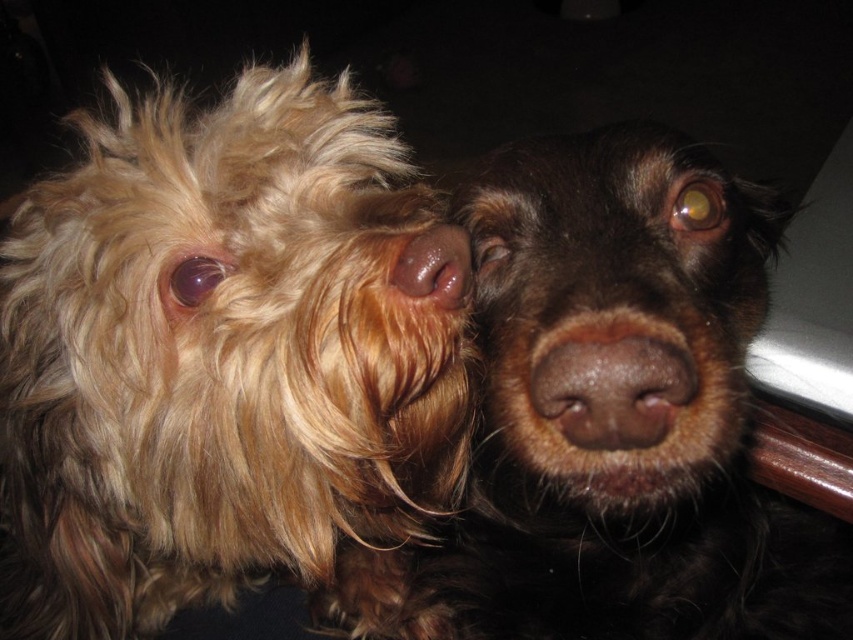
You are a photographer setting up a tripod between the shaggy golden fur at left and the brown furry dog at center. The tripod requires a minimum of 6 inches between the two subjects to focus properly. Will the current distance allow the tripod to focus?

The distance between the shaggy golden fur at left and the brown furry dog at center is 6.78 inches, which is more than the required 6 inches. Therefore, the tripod can focus properly.

You are standing in front of the two dogs in the scene. The shaggy golden fur at left is positioned at coordinates 0.566 on the x axis and 0.259 on the y axis. If you want to place a treat exactly between them, where should you place it?

The treat should be placed at the midpoint between the shaggy golden fur at left and the other dog. Since the shaggy golden fur at left is at coordinates (219, 362), the midpoint would be halfway between these coordinates and the position of the other dog.